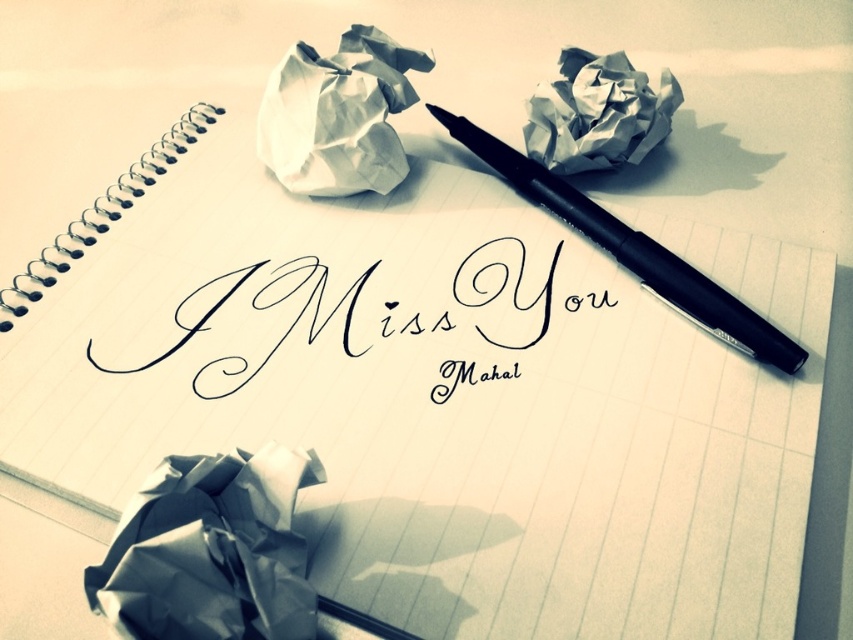
You need to place a 15 cm ruler between the black calligraphy at center and the black matte pen at center. Can the ruler fit entirely between them without overlapping either object?

The distance between the black calligraphy at center and the black matte pen at center is 17.10 centimeters, so a 15 cm ruler can fit entirely between them without overlapping either object since 15 cm is less than 17.10 cm.

You are organizing a desk and need to place a new item between the white crumpled paper at upper center and the black matte pen at center. Where should you place it to ensure it is between them?

Place the new item to the right of the white crumpled paper at upper center and to the left of the black matte pen at center since the white crumpled paper at upper center is on the left side of the black matte pen at center.

You are organizing a desk and need to place a new pen holder. The white crumpled paper at upper center and the black matte pen at center are currently on the desk. Where should you place the pen holder to ensure it doesn

The white crumpled paper at upper center is located above the black matte pen at center. To place the pen holder without disturbing the paper, position it below the white crumpled paper at upper center, near the black matte pen at center.